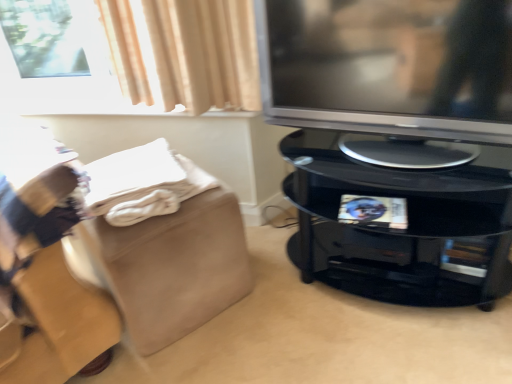
Question: Is glossy black tv stand at right not close to satin silver television at right?

Choices:
 (A) no
 (B) yes

Answer: (A)

Question: Is glossy black tv stand at right positioned in front of satin silver television at right?

Choices:
 (A) no
 (B) yes

Answer: (A)

Question: Is glossy black tv stand at right positioned beyond the bounds of satin silver television at right?

Choices:
 (A) no
 (B) yes

Answer: (B)

Question: Is glossy black tv stand at right positioned behind satin silver television at right?

Choices:
 (A) no
 (B) yes

Answer: (B)

Question: From the image's perspective, is glossy black tv stand at right located beneath satin silver television at right?

Choices:
 (A) yes
 (B) no

Answer: (A)

Question: Is glossy black tv stand at right facing towards satin silver television at right?

Choices:
 (A) no
 (B) yes

Answer: (A)

Question: Is white soft blanket at lower left far from glossy black tv stand at right?

Choices:
 (A) no
 (B) yes

Answer: (A)

Question: Is white soft blanket at lower left aimed at glossy black tv stand at right?

Choices:
 (A) no
 (B) yes

Answer: (A)

Question: Considering the relative sizes of white soft blanket at lower left and glossy black tv stand at right in the image provided, is white soft blanket at lower left taller than glossy black tv stand at right?

Choices:
 (A) no
 (B) yes

Answer: (A)

Question: Does white soft blanket at lower left have a larger size compared to glossy black tv stand at right?

Choices:
 (A) no
 (B) yes

Answer: (A)

Question: Is white soft blanket at lower left at the right side of glossy black tv stand at right?

Choices:
 (A) yes
 (B) no

Answer: (B)

Question: Are white soft blanket at lower left and glossy black tv stand at right beside each other?

Choices:
 (A) no
 (B) yes

Answer: (A)

Question: From a real-world perspective, is beige suede footrest at lower left below white soft blanket at lower left?

Choices:
 (A) yes
 (B) no

Answer: (A)